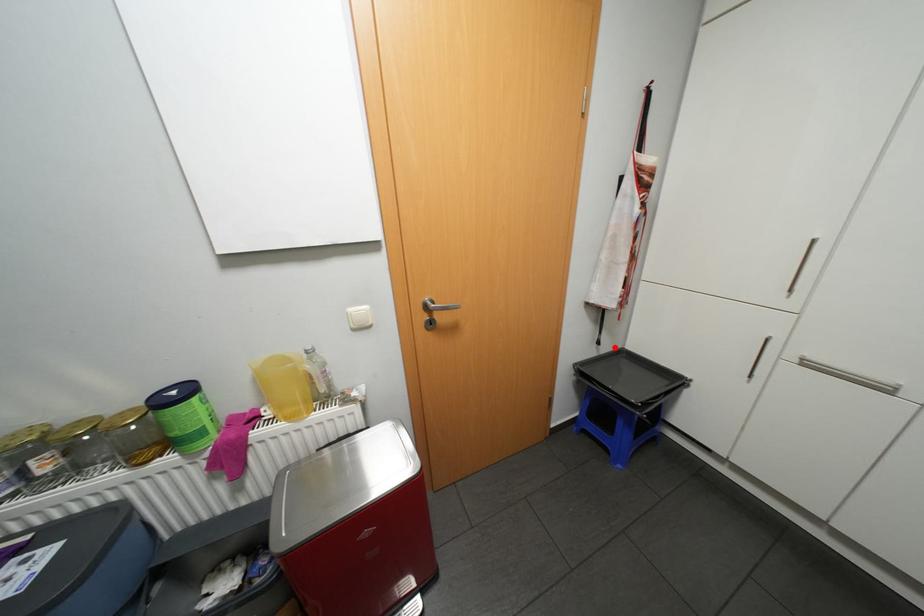
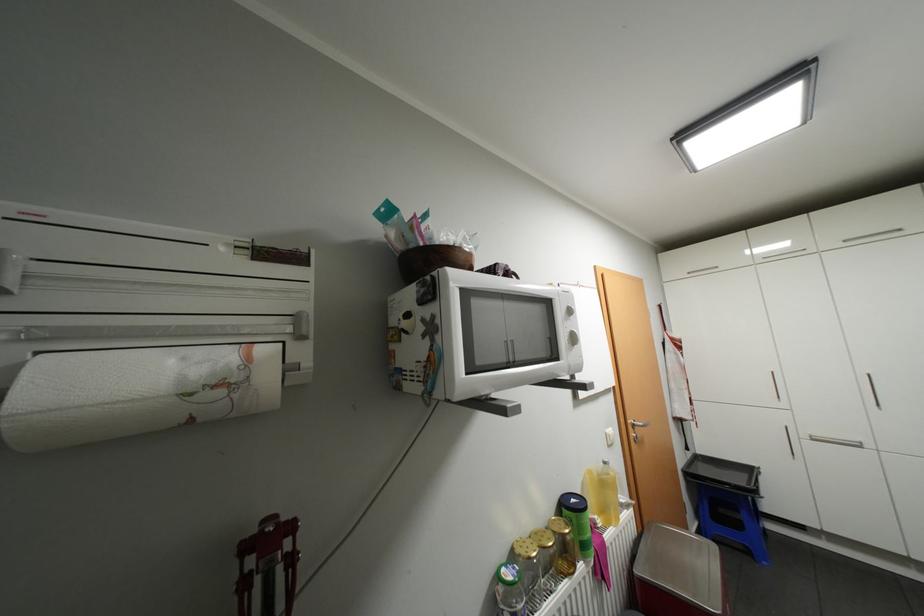
Where in the second image is the point corresponding to the highlighted location from the first image?

(697, 453)